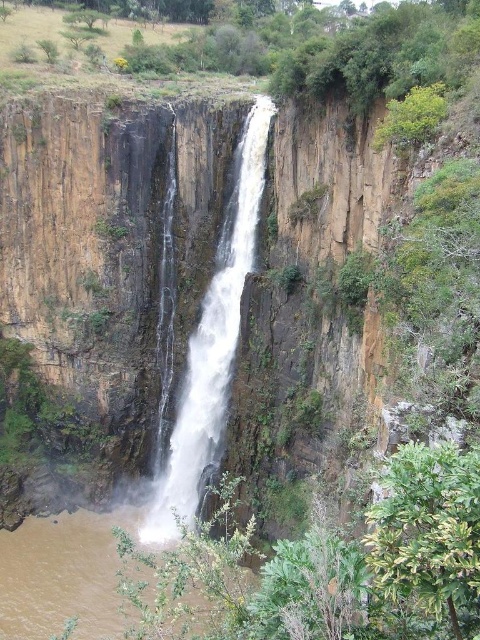
You are standing at the edge of the cliff overlooking the waterfall. You notice the white frothy water at center and the brown muddy water at lower center. Which body of water is positioned higher in elevation?

The white frothy water at center is located above the brown muddy water at lower center, meaning it has a higher elevation.

You are a photographer planning to capture the waterfall scene. You want to ensure both the white frothy water at center and the brown muddy water at lower center are clearly visible in your shot. Given their sizes, which one should you focus on to ensure both are in frame without cropping?

The white frothy water at center is smaller than the brown muddy water at lower center. To ensure both are in frame without cropping, focus on the larger brown muddy water at lower center, as it will occupy more space and allow the smaller white frothy water at center to remain visible.